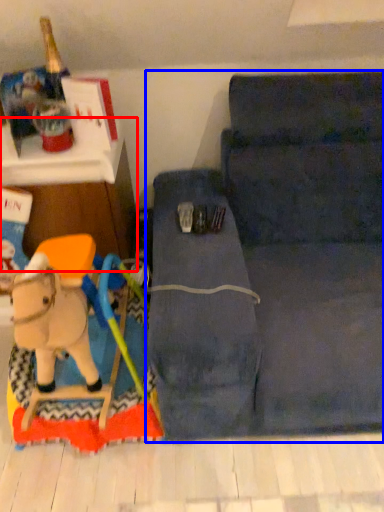
Question: Which object appears closest to the camera in this image, furniture (highlighted by a red box) or studio couch (highlighted by a blue box)?

Choices:
 (A) furniture
 (B) studio couch

Answer: (B)